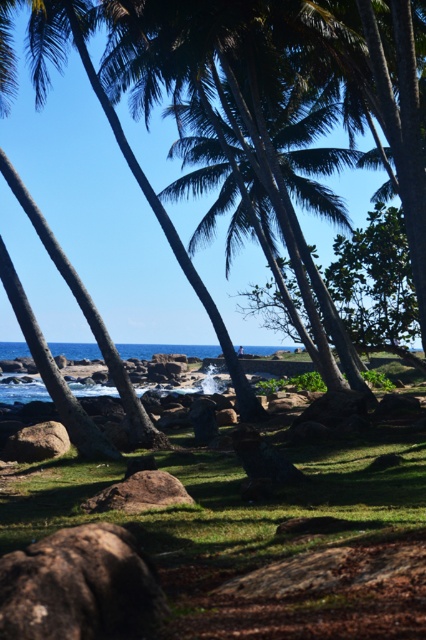
Is green grass at center to the left of blue water at center from the viewer's perspective?

No, green grass at center is not to the left of blue water at center.

Based on the photo, who is positioned more to the right, green grass at center or blue water at center?

green grass at center

Is point (319, 481) positioned in front of point (192, 344)?

Yes, point (319, 481) is in front of point (192, 344).

This screenshot has height=640, width=426. In order to click on green grass at center in this screenshot , I will do `click(232, 499)`.